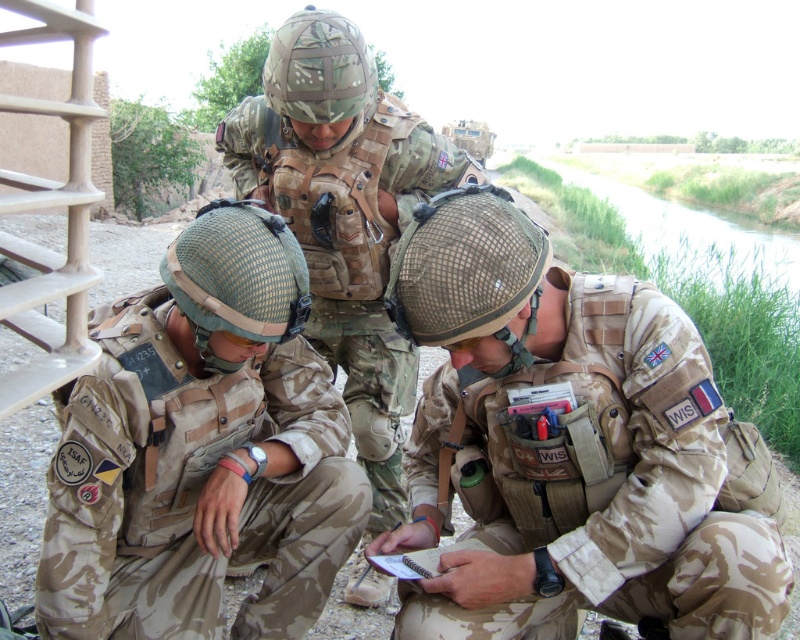
Is point (486, 632) farther from viewer compared to point (420, 124)?

No, it is in front of (420, 124).

Does camouflage fabric uniform at lower right have a larger size compared to camo fabric helmet at center?

Incorrect, camouflage fabric uniform at lower right is not larger than camo fabric helmet at center.

Between point (452, 627) and point (366, 145), which one is positioned behind?

Point (366, 145)

Find the location of a particular element. The image size is (800, 640). camouflage fabric uniform at lower right is located at coordinates (566, 448).

Consider the image. Who is positioned more to the left, camouflage fabric uniform at lower right or camouflage fabric uniform at lower left?

Positioned to the left is camouflage fabric uniform at lower left.

Who is shorter, camouflage fabric uniform at lower right or camouflage fabric uniform at lower left?

With less height is camouflage fabric uniform at lower left.

Which is in front, point (448, 413) or point (180, 515)?

Point (448, 413) is in front.

Identify the location of camouflage fabric uniform at lower right. (566, 448).

Can you confirm if camouflage fabric uniform at lower left is positioned above camo fabric helmet at center?

No, camouflage fabric uniform at lower left is not above camo fabric helmet at center.

Does camouflage fabric uniform at lower left have a greater height compared to camo fabric helmet at center?

No.

Locate an element on the screen. This screenshot has height=640, width=800. camouflage fabric uniform at lower left is located at coordinates (192, 488).